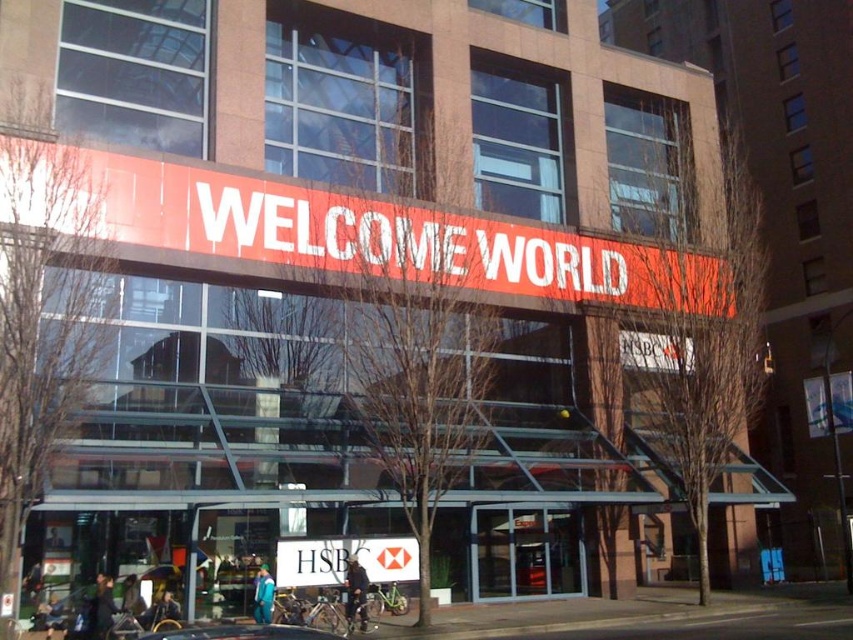
You are standing in front of the building and want to read the white paper sign at center. Which direction should you look to see it clearly?

The white paper sign at center is located at point (344, 561), which is towards the upper right of your field of view. Look towards the upper right direction to see it clearly.

You are standing in front of the building and want to read the white paper sign at center. Is the metallic silver car at lower center blocking your view of the sign?

The white paper sign at center is further to the viewer than the metallic silver car at lower center, so the car is behind the sign and not blocking your view.

You are standing in front of a modern building with a red welcome sign. There is a point at coordinates (344,561). What object is located at that point?

The white paper sign at center is located at point (344,561).